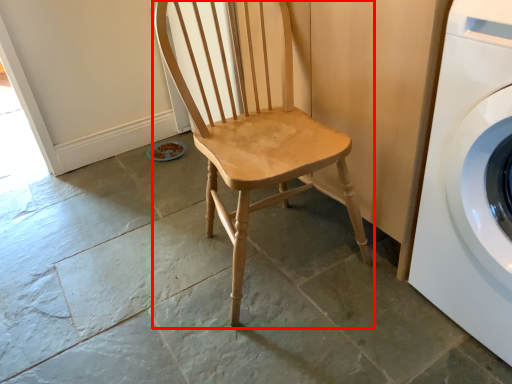
Question: From the image's perspective, where is chair (annotated by the red box) located in relation to washing machine in the image?

Choices:
 (A) below
 (B) above

Answer: (B)